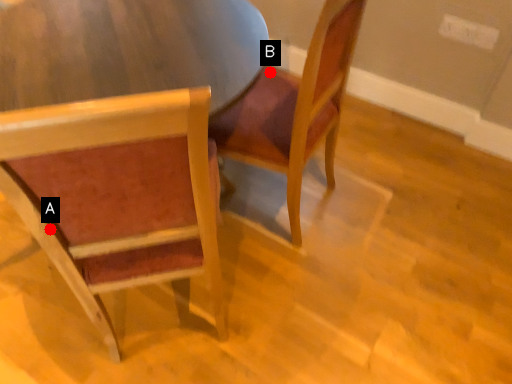
Question: Two points are circled on the image, labeled by A and B beside each circle. Which of the following is the closest to the observer?

Choices:
 (A) A is closer
 (B) B is closer

Answer: (A)